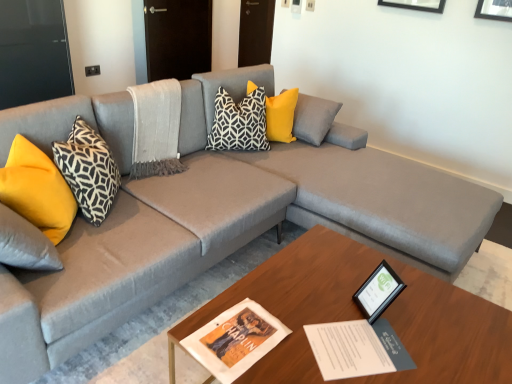
In order to click on vacant position to the left of black glossy picture frame at lower right in this screenshot , I will do `click(323, 304)`.